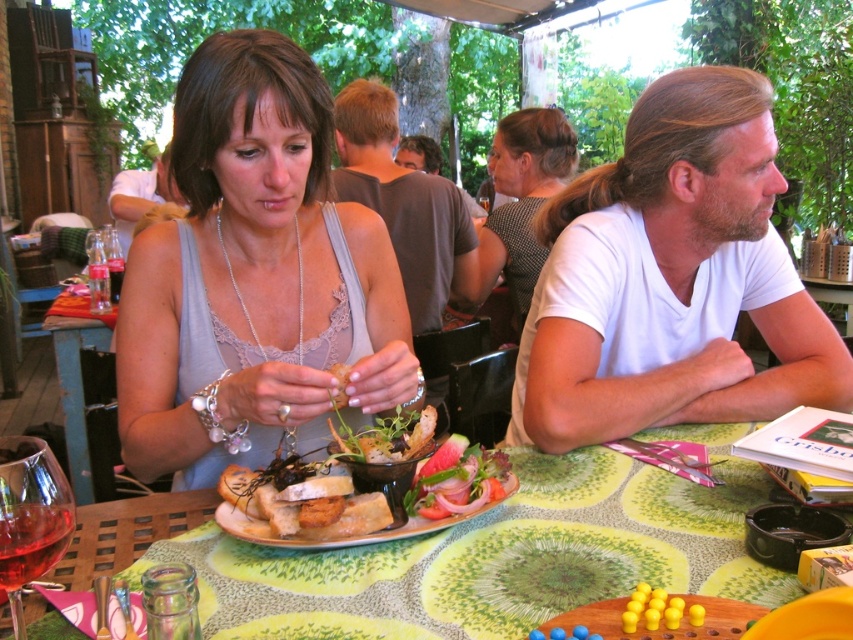
Question: Considering the relative positions of blue painted wood table at lower left and fresh green salad at center in the image provided, where is blue painted wood table at lower left located with respect to fresh green salad at center?

Choices:
 (A) left
 (B) right

Answer: (A)

Question: Which object is the closest to the fresh green salad at center?

Choices:
 (A) transparent glass wine at lower left
 (B) golden brown bread at center
 (C) golden crispy bread at center

Answer: (B)

Question: Is white cotton shirt at upper right bigger than fresh green salad at center?

Choices:
 (A) yes
 (B) no

Answer: (A)

Question: Which is farther from the white cotton shirt at upper right?

Choices:
 (A) matte gray tank top at center
 (B) golden brown bread at center

Answer: (B)

Question: Observing the image, what is the correct spatial positioning of white cotton shirt at upper right in reference to fresh green salad at center?

Choices:
 (A) below
 (B) above

Answer: (B)

Question: Which point appears closest to the camera in this image?

Choices:
 (A) (207, 432)
 (B) (271, 524)
 (C) (798, 280)
 (D) (26, 483)

Answer: (D)